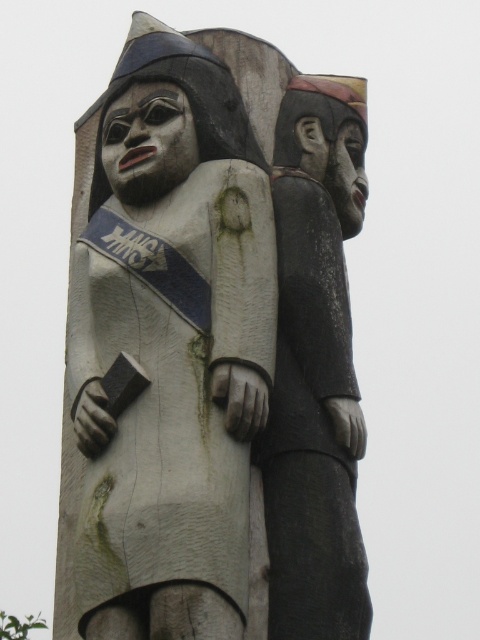
You are an artist trying to sketch the wooden totem pole at center and the dark gray wood figure at right. If you want to draw them to scale, which object should you make wider in your drawing?

You should make the wooden totem pole at center wider in your drawing since it is wider than the dark gray wood figure at right according to the description.

You are an art conservator examining a carved wooden totem pole. You notice the wooden totem pole at center and the dark gray wood figure at right. Which object is located more to the left side of the image?

The wooden totem pole at center is positioned on the left side of dark gray wood figure at right, so it is more to the left.

You are an art restorer examining the wooden totem pole at center and the dark gray wood figure at right. Which object would require you to step closer to work on its details?

The wooden totem pole at center is closer to the viewer than the dark gray wood figure at right, so you would need to work on the wooden totem pole at center without moving closer, while the dark gray wood figure at right would require stepping forward to access its details.